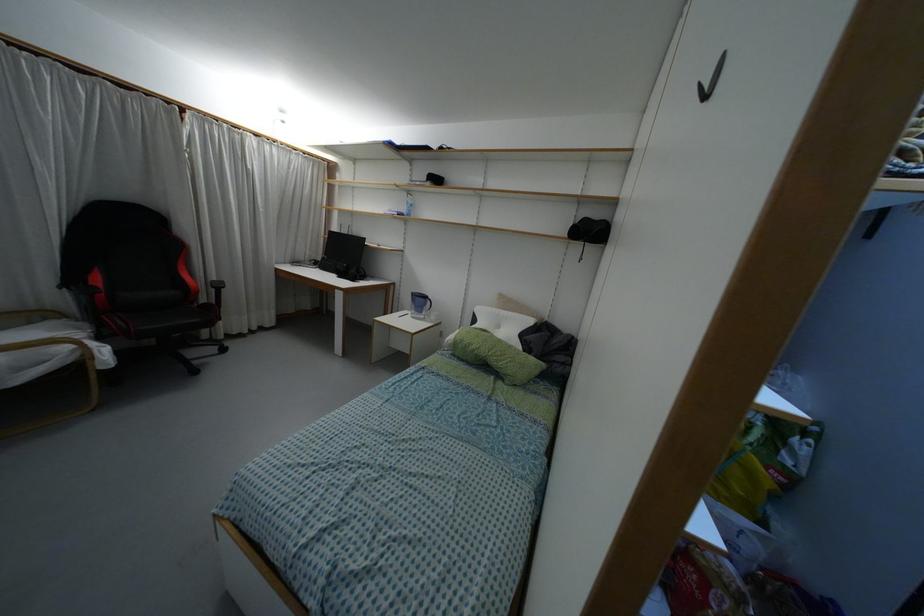
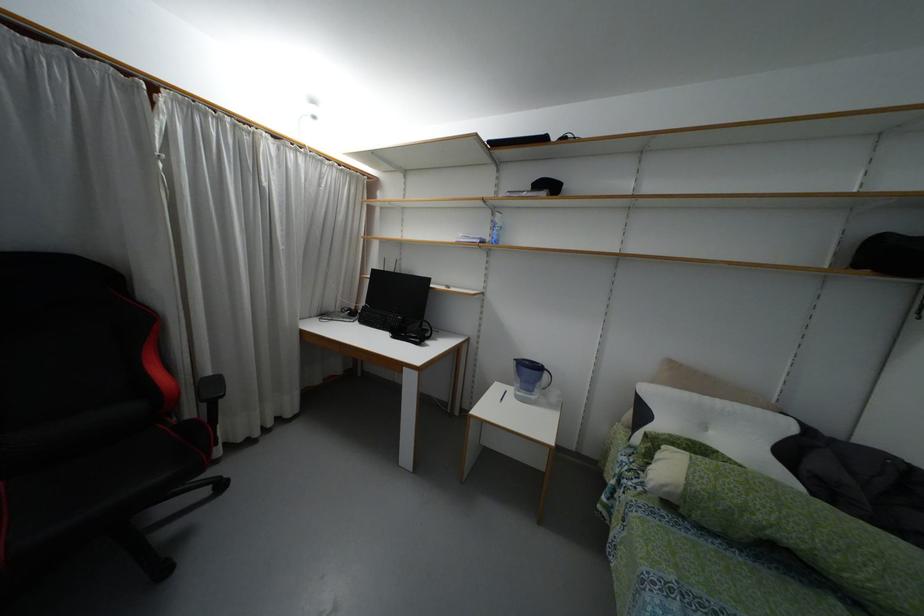
Locate, in the second image, the point that corresponds to (x=428, y=302) in the first image.

(544, 375)